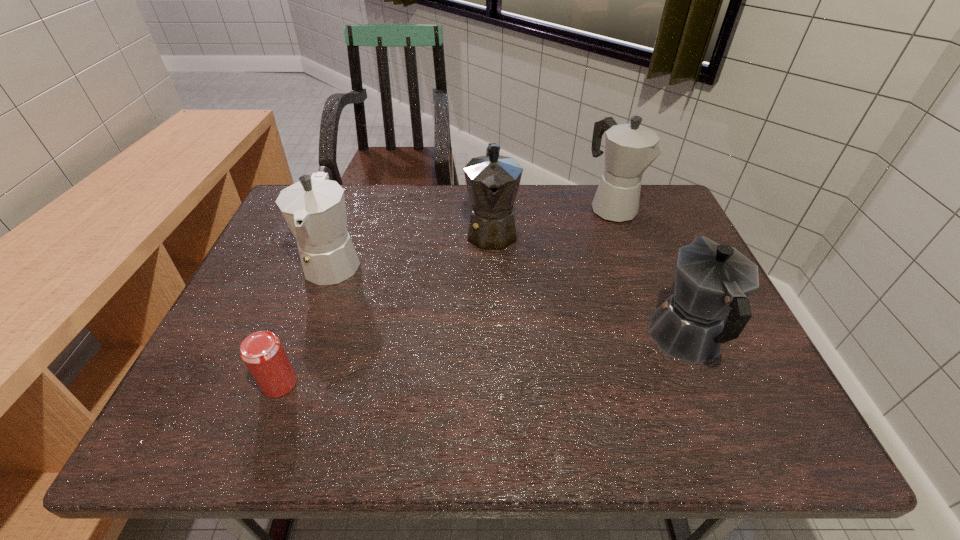
Find the location of `the third object from right to left`. the third object from right to left is located at coordinates (492, 181).

In order to click on the leftmost coffeepot in this screenshot , I will do `click(314, 208)`.

You are a GUI agent. You are given a task and a screenshot of the screen. Output one action in this format:
    pyautogui.click(x=<x>, y=<y>)
    Task: Click on the nearest coffeepot
    Image resolution: width=960 pixels, height=540 pixels.
    Given the screenshot: What is the action you would take?
    pyautogui.click(x=712, y=280)

Find the location of a particular element. This screenshot has width=960, height=540. beer can is located at coordinates (262, 352).

I want to click on free location located 0.090m on the pouring side of the third object from right to left, so click(x=493, y=282).

This screenshot has width=960, height=540. In order to click on free space located 0.370m at the spout of the leftmost coffeepot in this screenshot , I will do `click(271, 437)`.

This screenshot has height=540, width=960. In order to click on vacant space located 0.290m at the spout of the nearest coffeepot in this screenshot , I will do `click(639, 228)`.

The width and height of the screenshot is (960, 540). What are the coordinates of `vacant area located at the spout of the nearest coffeepot` in the screenshot? It's located at (632, 210).

The height and width of the screenshot is (540, 960). I want to click on vacant space located at the spout of the nearest coffeepot, so click(x=648, y=248).

In order to click on blank space located on the back of the shortest object in this screenshot , I will do `click(329, 252)`.